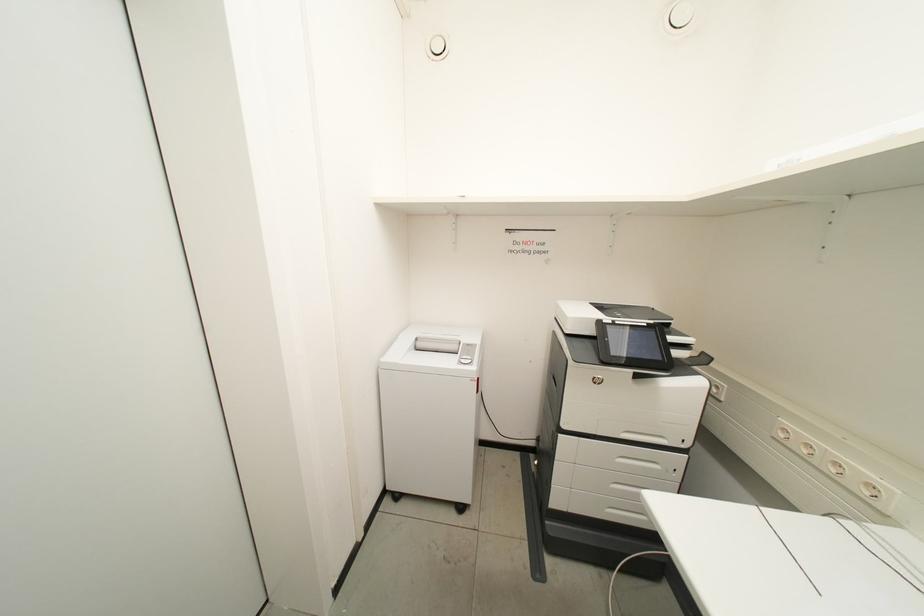
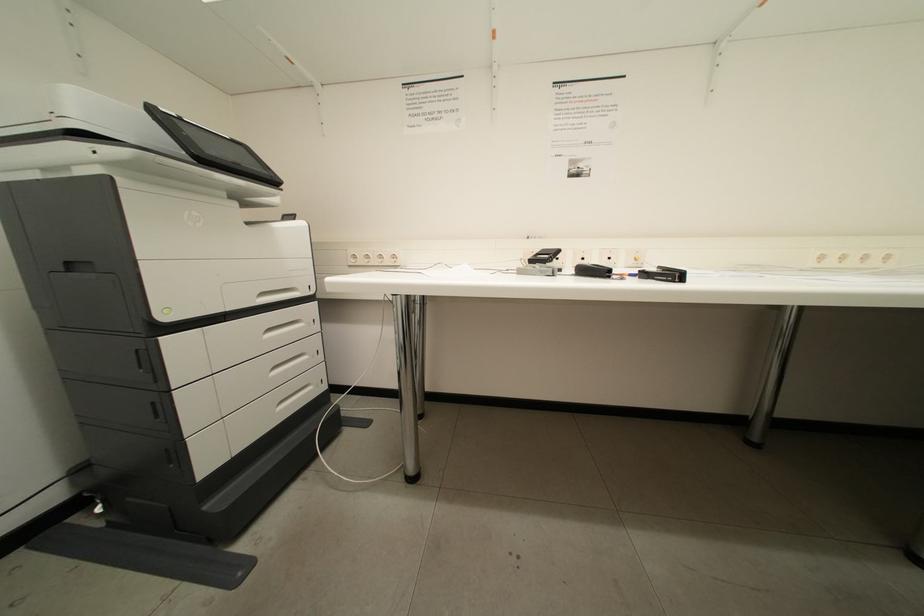
Question: Based on the continuous images, in which direction is the camera rotating? Reply with the corresponding letter.

Choices:
 (A) Left
 (B) Right
 (C) Up
 (D) Down

Answer: (B)